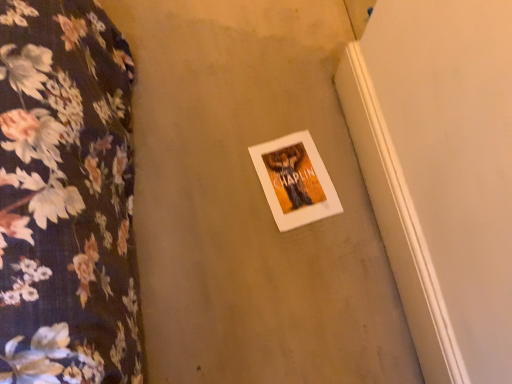
The width and height of the screenshot is (512, 384). Identify the location of empty space that is to the right of white paper at center. (344, 199).